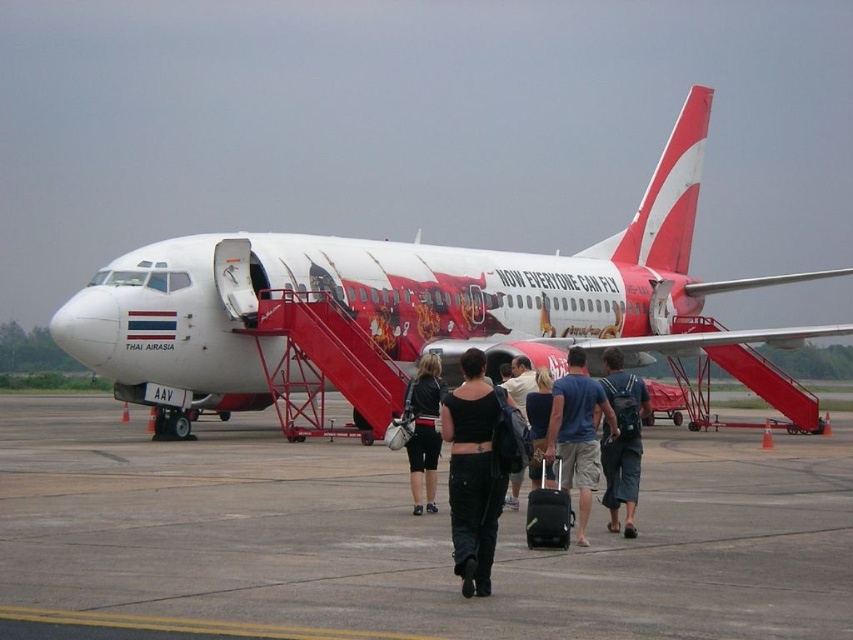
You are a flight attendant standing at the boarding stairs. You need to retrieve both the black cotton tank top at center and the leather jacket at center from the passengers near the aircraft. What is the minimum distance you must walk to collect both items?

The black cotton tank top at center and the leather jacket at center are 12.97 feet apart. To collect both items, the flight attendant must walk a minimum distance of 12.97 feet, assuming they start at one item and move directly to the other.

You are a passenger with a black fabric suitcase at center who needs to reach the boarding stairs located at the edge of the concrete tarmac at center. Can you carry your suitcase the 5.05 meters to the boarding stairs?

The distance between the concrete tarmac at center and the black fabric suitcase at center is 5.05 meters. Since the boarding stairs are at the edge of the concrete tarmac at center, you would need to carry your suitcase approximately 5.05 meters to reach them.

You are a traveler observing the Thai AirAsia aircraft and notice two items at the center of the image. Which item is bigger between the black cotton tank top at center and the leather jacket at center?

The black cotton tank top at center is larger in size than the leather jacket at center.